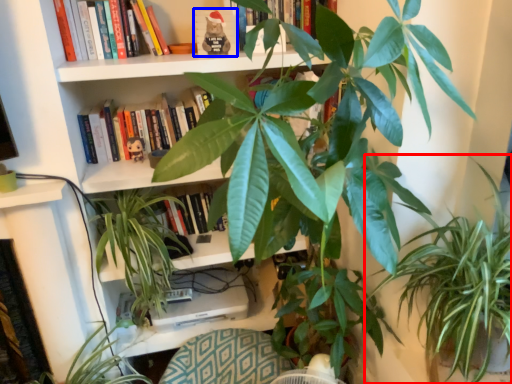
Question: Among these objects, which one is nearest to the camera, houseplant (highlighted by a red box) or paperback book (highlighted by a blue box)?

Choices:
 (A) houseplant
 (B) paperback book

Answer: (A)